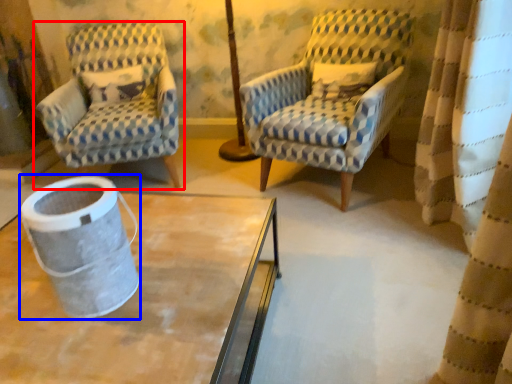
Question: Which of the following is the closest to the observer, chair (highlighted by a red box) or gray (highlighted by a blue box)?

Choices:
 (A) chair
 (B) gray

Answer: (B)